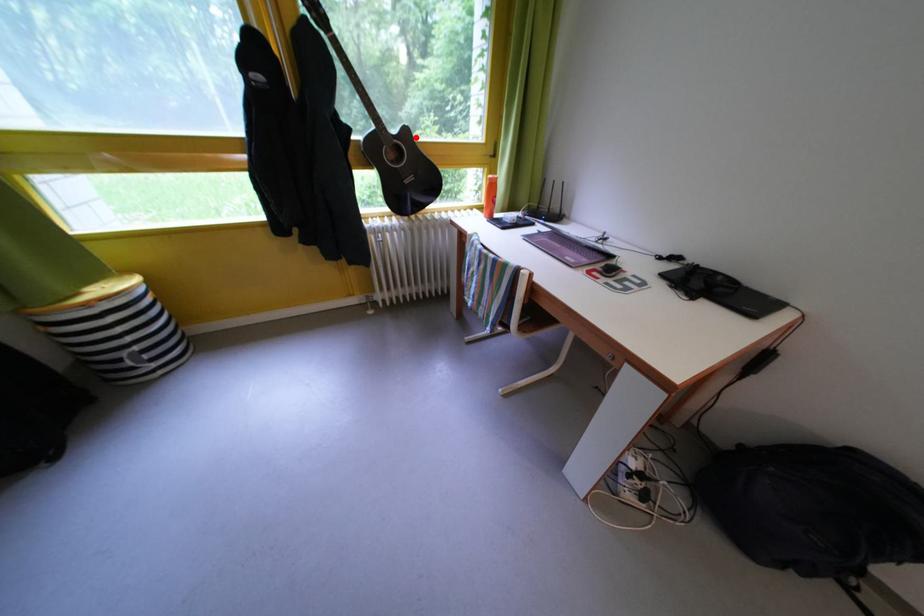
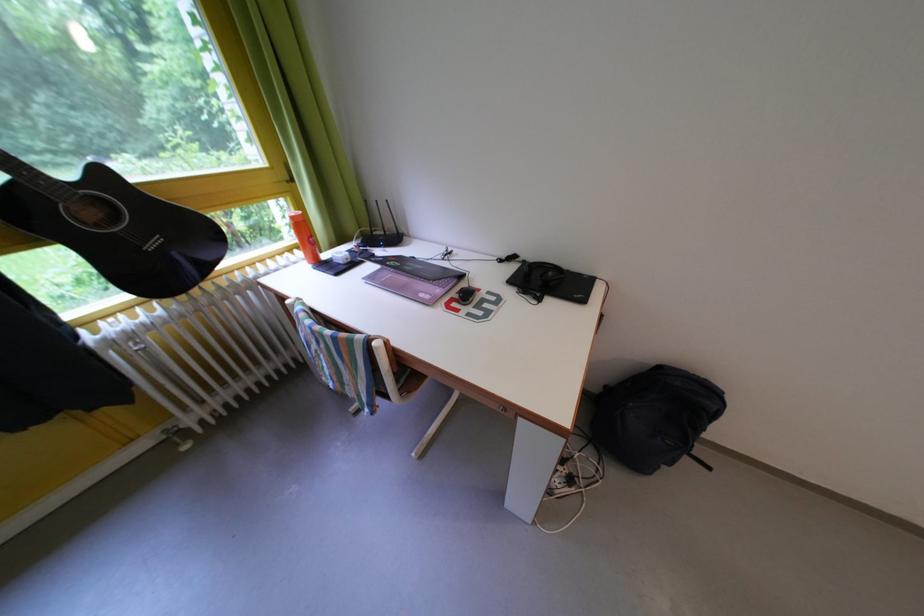
The point at the highlighted location is marked in the first image. Where is the corresponding point in the second image?

(112, 179)